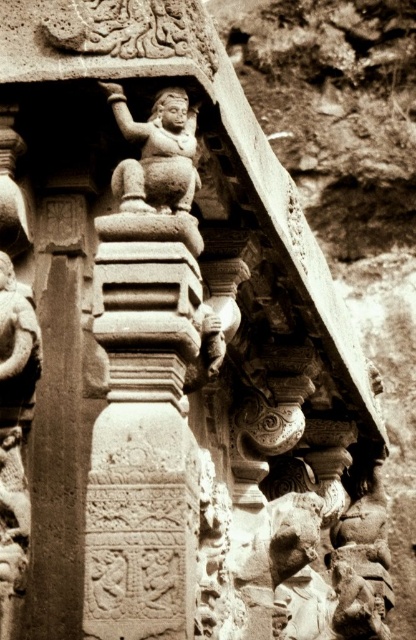
Is point (56, 528) less distant than point (188, 160)?

No, it is not.

Between point (29, 616) and point (178, 154), which one is positioned behind?

The point (178, 154) is behind.

Who is more distant from viewer, (x=29, y=602) or (x=185, y=122)?

Point (x=185, y=122)

Locate an element on the screen. The width and height of the screenshot is (416, 640). carved stone column at center is located at coordinates (57, 426).